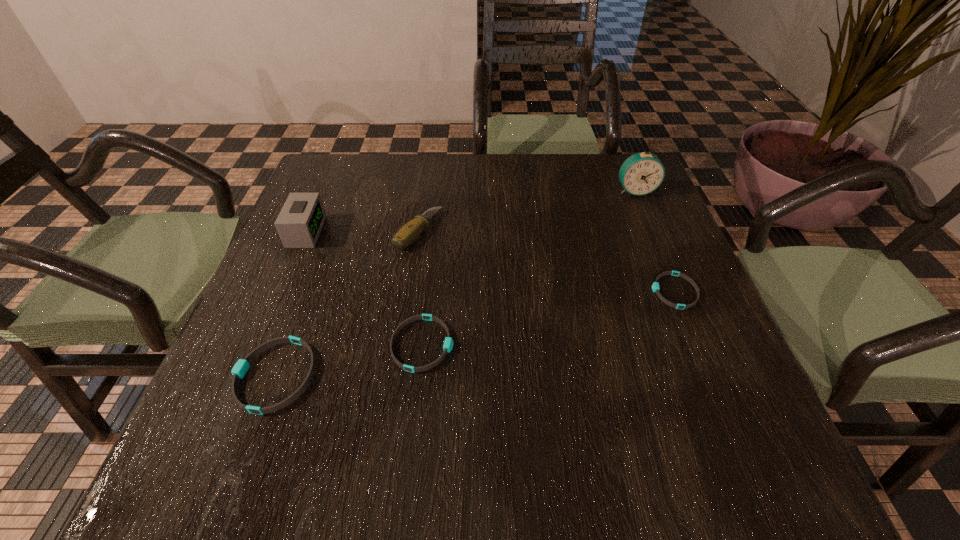
Image resolution: width=960 pixels, height=540 pixels. Identify the location of vacant region between the farthest object and the third tallest object. (527, 211).

Where is `free point between the fourth farthest object and the nearer alarm clock`? The image size is (960, 540). free point between the fourth farthest object and the nearer alarm clock is located at coordinates [x=490, y=261].

Image resolution: width=960 pixels, height=540 pixels. I want to click on vacant space in between the taller alarm clock and the fifth tallest object, so click(x=529, y=267).

This screenshot has width=960, height=540. Find the location of `vacant area between the left alarm clock and the farthest object`. vacant area between the left alarm clock and the farthest object is located at coordinates (470, 211).

Locate an element on the screen. The height and width of the screenshot is (540, 960). free spot between the fifth shortest object and the second shortest object is located at coordinates (364, 288).

Where is `free space between the farthest object and the left alarm clock`? The image size is (960, 540). free space between the farthest object and the left alarm clock is located at coordinates (470, 211).

Identify the location of vacant space in between the nearer alarm clock and the tallest wristband. The height and width of the screenshot is (540, 960). (290, 304).

Where is `empty location between the pocketknife and the taller alarm clock`? The width and height of the screenshot is (960, 540). empty location between the pocketknife and the taller alarm clock is located at coordinates (x=527, y=211).

Where is `free space between the shortest object and the leftmost wristband`? This screenshot has height=540, width=960. free space between the shortest object and the leftmost wristband is located at coordinates (474, 334).

Identify the location of free space between the fourth tallest object and the second shortest object. (348, 360).